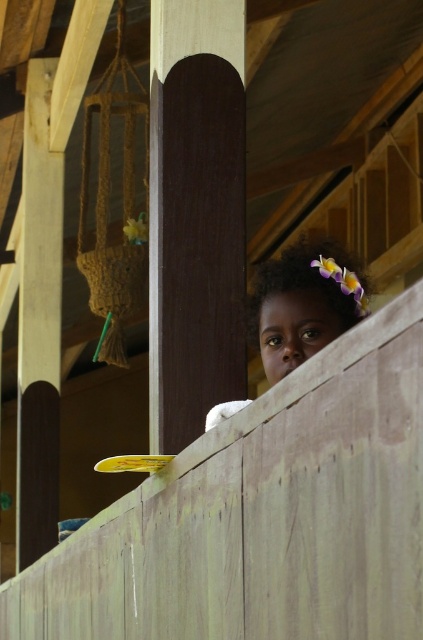
Question: Does dark wood pole at center lie in front of dark brown hair at upper center?

Choices:
 (A) yes
 (B) no

Answer: (B)

Question: Can you confirm if dark wood pole at center is bigger than dark brown hair at upper center?

Choices:
 (A) yes
 (B) no

Answer: (A)

Question: Can you confirm if dark wood pole at center is positioned to the right of dark brown hair at upper center?

Choices:
 (A) yes
 (B) no

Answer: (B)

Question: Among these points, which one is farthest from the camera?

Choices:
 (A) (192, 176)
 (B) (269, 330)

Answer: (A)

Question: Which point appears farthest from the camera in this image?

Choices:
 (A) (258, 304)
 (B) (189, 52)

Answer: (B)